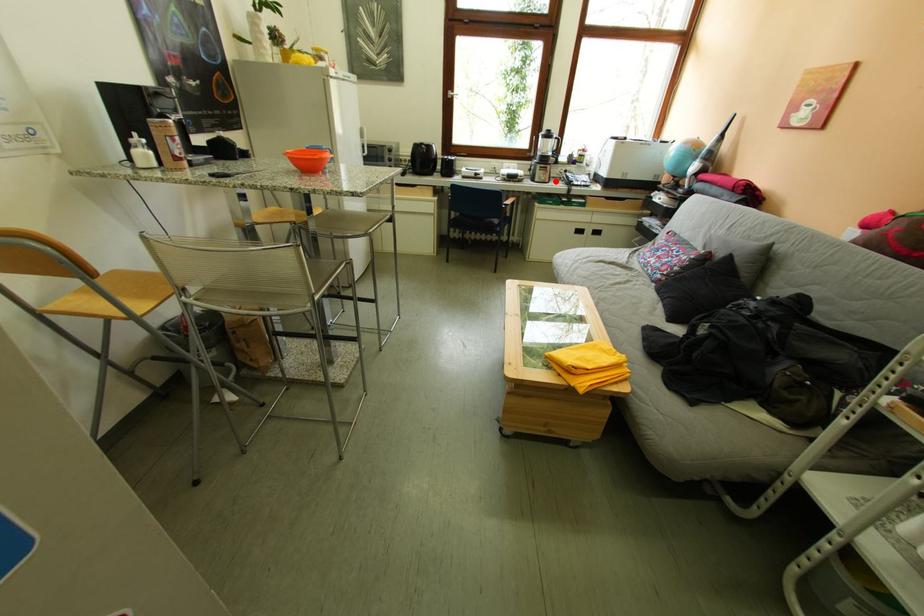
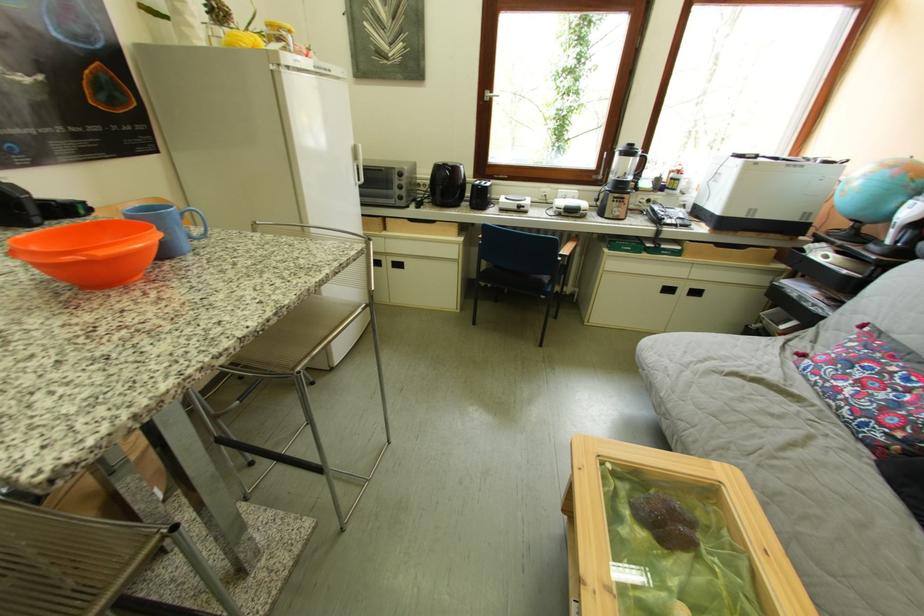
Question: I am providing you with two images of the same scene from different viewpoints. A red point is shown in image1. For the corresponding object point in image2, is it positioned nearer or farther from the camera?

Choices:
 (A) Nearer
 (B) Farther

Answer: (B)